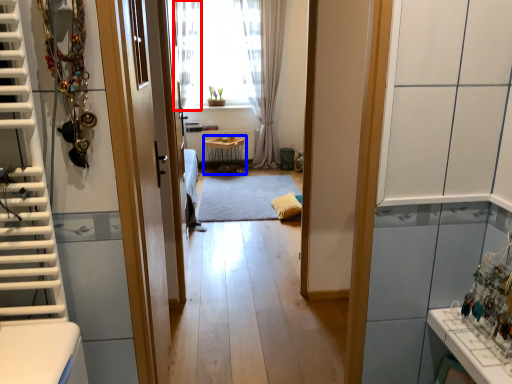
Question: Which object is closer to the camera taking this photo, curtain (highlighted by a red box) or table (highlighted by a blue box)?

Choices:
 (A) curtain
 (B) table

Answer: (A)